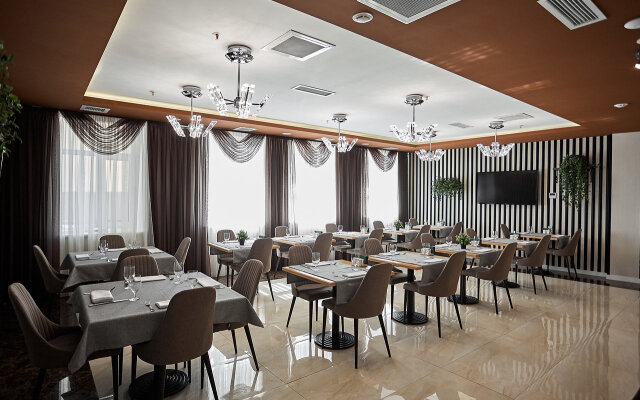
Where is `ceiling air vents`? The width and height of the screenshot is (640, 400). ceiling air vents is located at coordinates (292, 42), (307, 86), (518, 116), (457, 124), (573, 9), (420, 6).